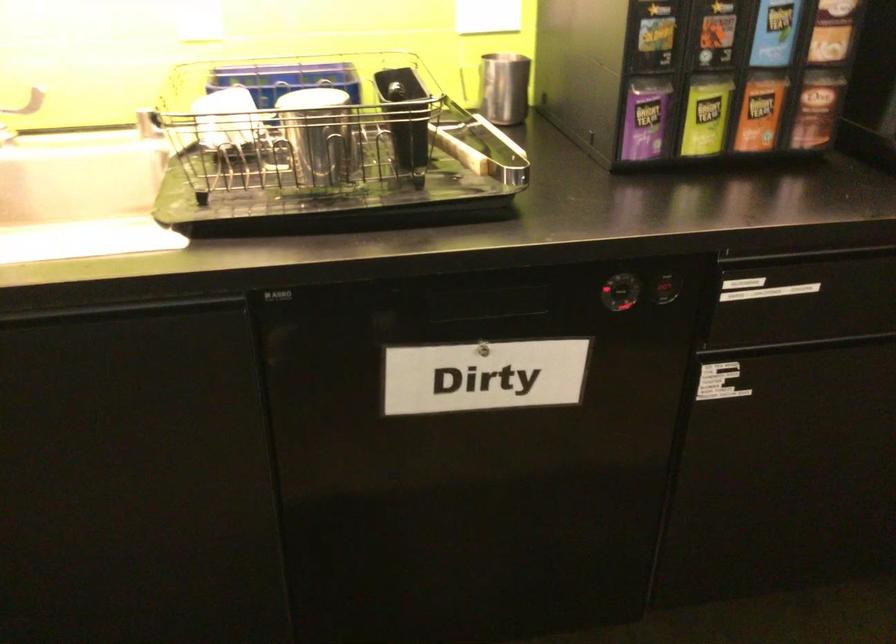
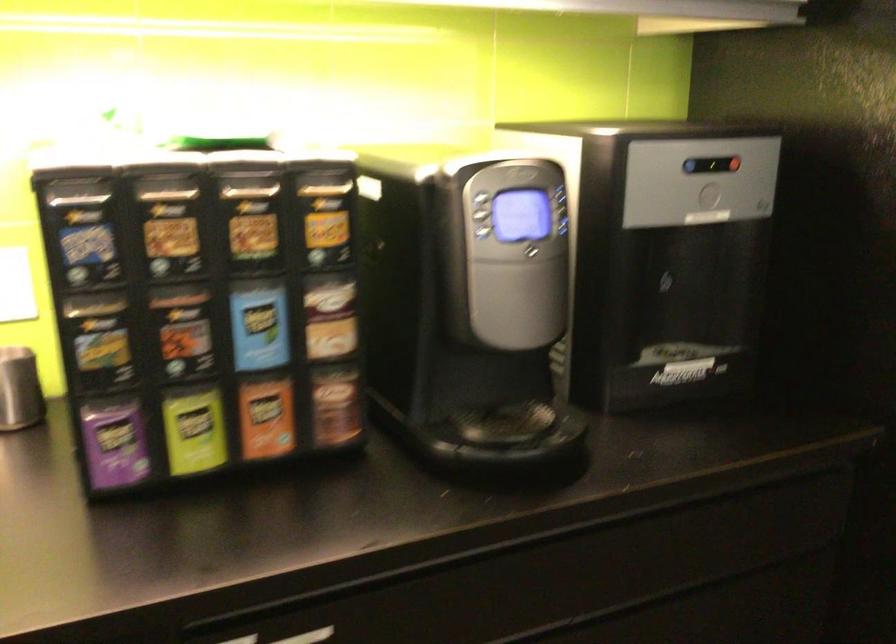
Locate, in the second image, the point that corresponds to pixel 805 287 in the first image.

(308, 636)